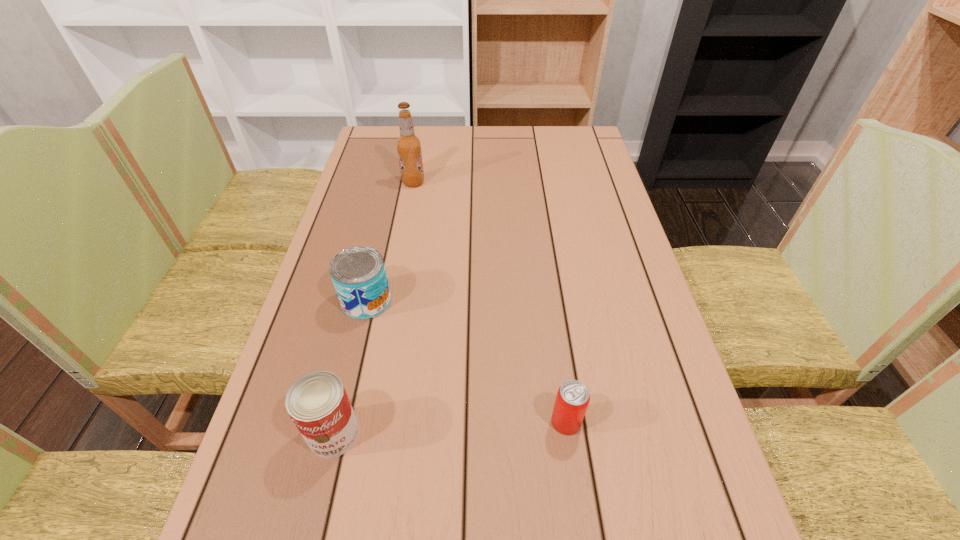
Find the location of a particular element. This screenshot has height=540, width=960. vacant space that satisfies the following two spatial constraints: 1. on the front label of the rightmost can; 2. on the right side of the beer bottle is located at coordinates (370, 422).

At what (x,y) coordinates should I click in order to perform the action: click on vacant area that satisfies the following two spatial constraints: 1. on the front label of the farthest object; 2. on the right side of the rightmost can. Please return your answer as a coordinate pair (x, y). Looking at the image, I should click on (370, 422).

This screenshot has height=540, width=960. In order to click on free location that satisfies the following two spatial constraints: 1. on the front label of the beer bottle; 2. on the right side of the rightmost object in this screenshot , I will do `click(370, 422)`.